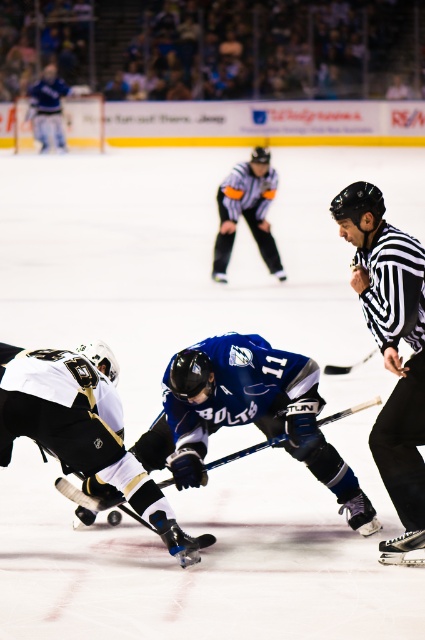
Looking at this image, can you confirm if blue glossy hockey stick at center is shorter than white jersey at center?

Yes.

Between point (317, 381) and point (37, 364), which one is positioned in front?

Point (37, 364)

Is point (198, 465) more distant than point (95, 424)?

Yes, it is behind point (95, 424).

I want to click on blue glossy hockey stick at center, so click(246, 412).

Is blue glossy hockey stick at center above black striped shirt at center?

Incorrect, blue glossy hockey stick at center is not positioned above black striped shirt at center.

Who is more forward, (337, 467) or (410, 356)?

Point (410, 356)

At what (x,y) coordinates should I click in order to perform the action: click on blue glossy hockey stick at center. Please return your answer as a coordinate pair (x, y). The width and height of the screenshot is (425, 640). Looking at the image, I should click on (246, 412).

Which of these two, blue glossy hockey stick at center or striped jersey at center, stands taller?

Standing taller between the two is striped jersey at center.

Who is more forward, (153, 465) or (258, 192)?

Point (153, 465) is in front.

Find the location of `blue glossy hockey stick at center`. blue glossy hockey stick at center is located at coordinates (246, 412).